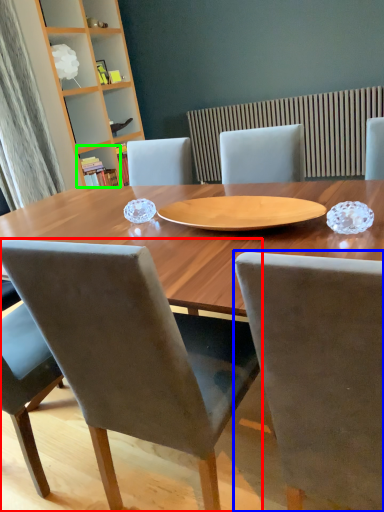
Question: Considering the real-world distances, which object is farthest from chair (highlighted by a red box)? chair (highlighted by a blue box) or shelf (highlighted by a green box)?

Choices:
 (A) chair
 (B) shelf

Answer: (B)